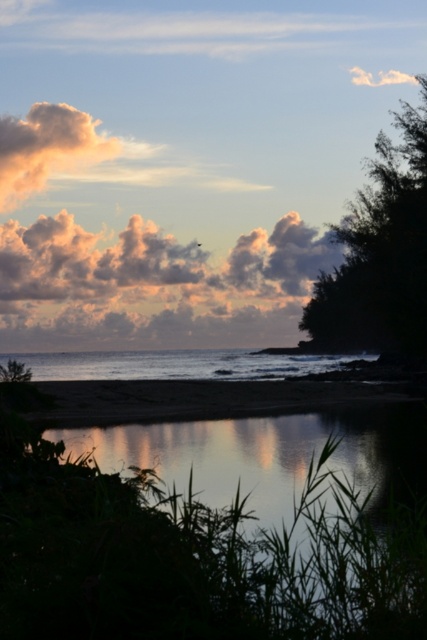
Question: In this image, where is green leafy tree at right located relative to cloudy cotton cloud at upper left?

Choices:
 (A) above
 (B) below

Answer: (B)

Question: Which of the following is the farthest from the observer?

Choices:
 (A) green leafy tree at right
 (B) clear water at center

Answer: (A)

Question: Considering the real-world distances, which object is farthest from the green leafy tree at right?

Choices:
 (A) cloudy cotton cloud at center
 (B) clear water at center

Answer: (A)

Question: Is clear water at center positioned before cloudy cotton cloud at upper left?

Choices:
 (A) yes
 (B) no

Answer: (A)

Question: Is silvery reflective water at lower center closer to the viewer compared to sandy shore at lower center?

Choices:
 (A) no
 (B) yes

Answer: (B)

Question: Which point is farther to the camera?

Choices:
 (A) (55, 109)
 (B) (354, 289)
 (C) (242, 358)

Answer: (A)